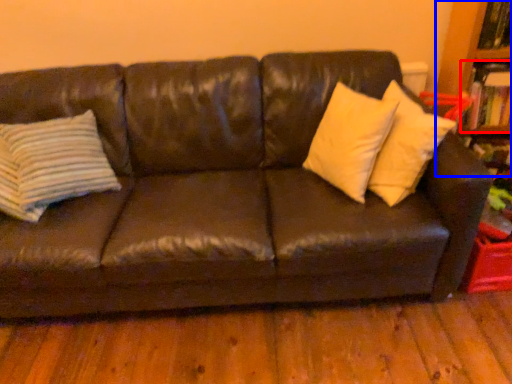
Question: Which object is closer to the camera taking this photo, book (highlighted by a red box) or bookcase (highlighted by a blue box)?

Choices:
 (A) book
 (B) bookcase

Answer: (B)